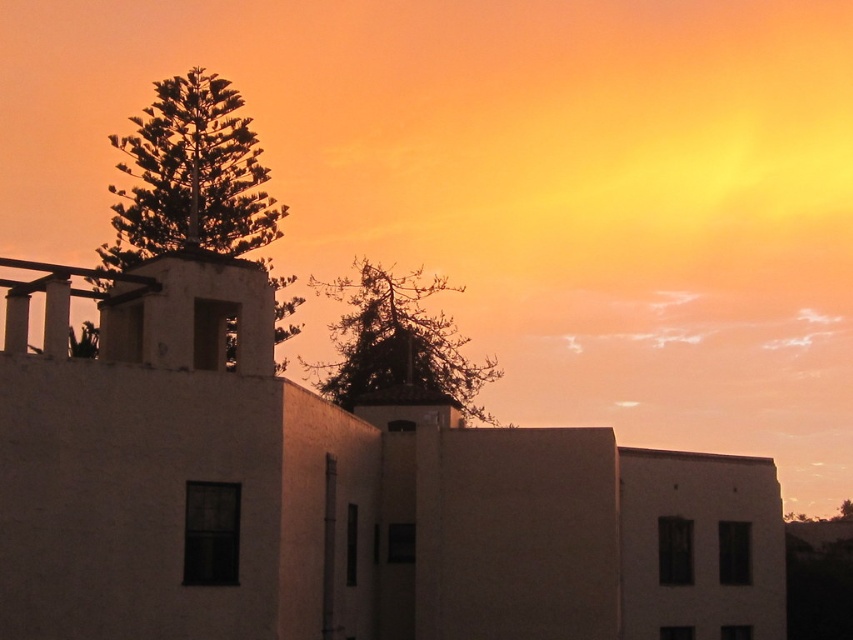
You are a drone operator planning to fly a drone between the green leafy tree at upper left and the silvery metallic tree at upper center. The drone has a maximum flight distance of 8 meters. Based on the scene, can the drone safely make this flight without exceeding its range?

The green leafy tree at upper left and silvery metallic tree at upper center are 8.60 meters apart from each other. Since the drone has a maximum flight distance of 8 meters, it cannot safely make this flight without exceeding its range.

You are standing in the sunset scene and want to walk from the point at coordinates (200, 234) to the point at (415, 308). Based on the scene description, will you be moving towards the horizon or away from it?

Since point (200, 234) is in front of point (415, 308), moving from the first point to the second would mean moving away from the horizon towards the background of the scene.